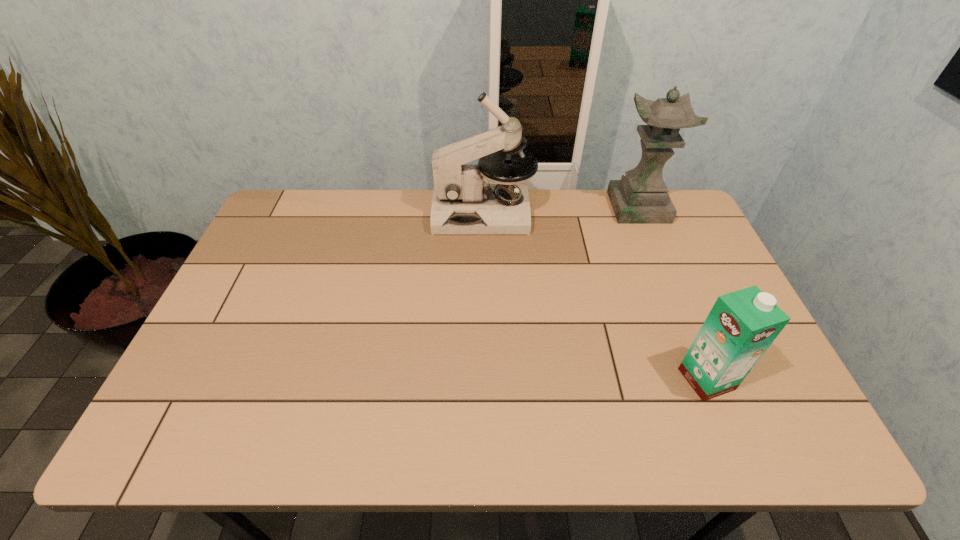
This screenshot has height=540, width=960. I want to click on sculpture, so click(x=640, y=197).

The image size is (960, 540). What are the coordinates of `the leftmost object` in the screenshot? It's located at (464, 202).

The image size is (960, 540). Identify the location of carton. (741, 326).

At what (x,y) coordinates should I click in order to perform the action: click on the shortest object. Please return your answer as a coordinate pair (x, y). The image size is (960, 540). Looking at the image, I should click on (741, 326).

Image resolution: width=960 pixels, height=540 pixels. Find the location of `vacant space located at the front opening of the sculpture`. vacant space located at the front opening of the sculpture is located at coordinates (580, 207).

This screenshot has height=540, width=960. Find the location of `free space located 0.170m at the front opening of the sculpture`. free space located 0.170m at the front opening of the sculpture is located at coordinates (563, 207).

Find the location of a particular element. free space located 0.400m at the front opening of the sculpture is located at coordinates (495, 207).

Find the location of a particular element. Image resolution: width=960 pixels, height=540 pixels. vacant space positioned at the eyepiece of the leftmost object is located at coordinates (407, 213).

You are a GUI agent. You are given a task and a screenshot of the screen. Output one action in this format:
    pyautogui.click(x=<x>, y=<y>)
    Task: Click on the vacant area situated 0.330m at the eyepiece of the leftmost object
    
    Given the screenshot: What is the action you would take?
    pyautogui.click(x=337, y=213)

Identify the location of free space located at the eyepiece of the leftmost object. This screenshot has height=540, width=960. (343, 213).